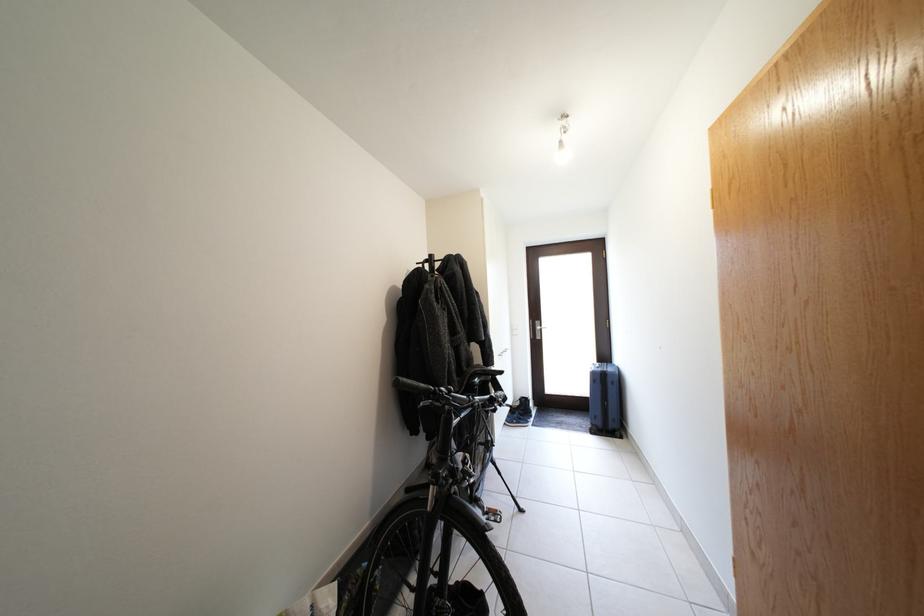
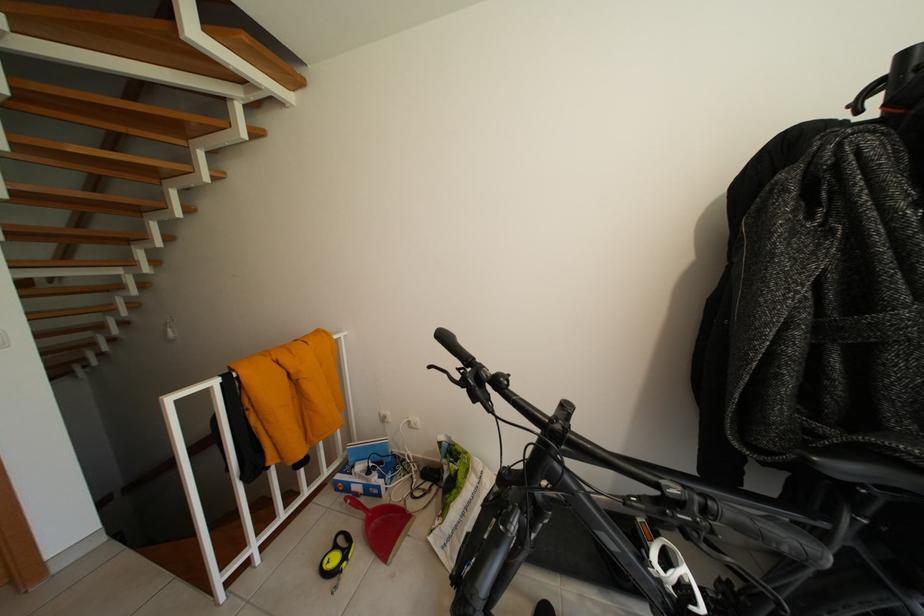
Question: The camera is either moving clockwise (left) or counter-clockwise (right) around the object. The first image is from the beginning of the video and the second image is from the end. Is the camera moving left or right when shooting the video?

Choices:
 (A) Left
 (B) Right

Answer: (B)